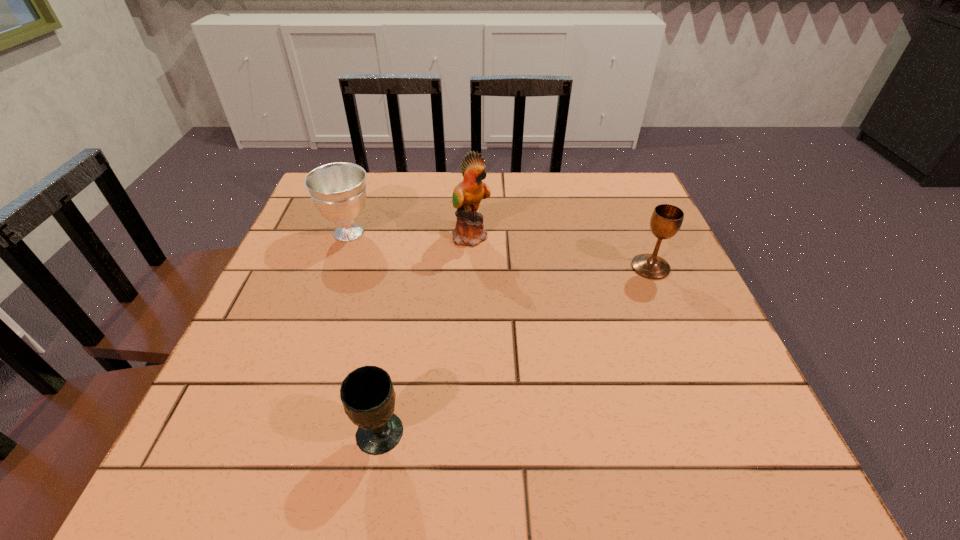
This screenshot has height=540, width=960. In order to click on vacant position at the right edge of the desktop in this screenshot , I will do `click(691, 345)`.

Identify the location of vacant region at the near left corner of the desktop. [x=210, y=454].

At what (x,y) coordinates should I click in order to perform the action: click on vacant area at the near right corner. Please return your answer as a coordinate pair (x, y). This screenshot has height=540, width=960. Looking at the image, I should click on (717, 460).

This screenshot has width=960, height=540. I want to click on free spot between the nearest chalice and the farthest chalice, so click(x=364, y=333).

Image resolution: width=960 pixels, height=540 pixels. Identify the location of empty space that is in between the tallest object and the leftmost chalice. click(410, 234).

At what (x,y) coordinates should I click in order to perform the action: click on vacant space in between the second chalice from right to left and the leftmost object. Please return your answer as a coordinate pair (x, y). The width and height of the screenshot is (960, 540). Looking at the image, I should click on (364, 333).

You are a GUI agent. You are given a task and a screenshot of the screen. Output one action in this format:
    pyautogui.click(x=<x>, y=<y>)
    Task: Click on the free point between the rightmost object and the leftmost chalice
    Image resolution: width=960 pixels, height=540 pixels.
    Given the screenshot: What is the action you would take?
    pyautogui.click(x=500, y=250)

At what (x,y) coordinates should I click in order to perform the action: click on unoccupied area between the second object from left to right and the third object from left to right. Please return your answer as a coordinate pair (x, y). Looking at the image, I should click on (425, 335).

Find the location of a particular element. The width and height of the screenshot is (960, 540). unoccupied position between the nearest object and the leftmost object is located at coordinates (364, 333).

Where is `vacant area that lies between the farthest chalice and the nearest object`? vacant area that lies between the farthest chalice and the nearest object is located at coordinates (364, 333).